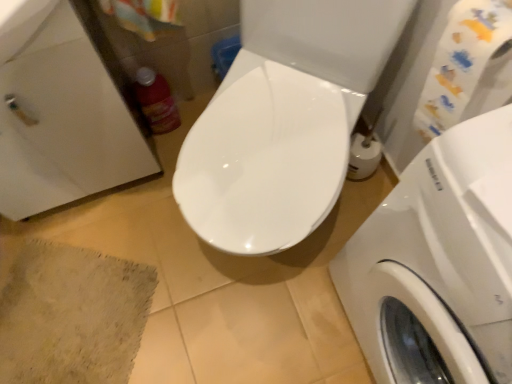
Question: From a real-world perspective, does matte plastic bottle at left sit lower than white glossy washing machine at right?

Choices:
 (A) yes
 (B) no

Answer: (A)

Question: Is white glossy washing machine at right inside matte plastic bottle at left?

Choices:
 (A) yes
 (B) no

Answer: (B)

Question: From a real-world perspective, is matte plastic bottle at left located higher than white glossy washing machine at right?

Choices:
 (A) yes
 (B) no

Answer: (B)

Question: From the image's perspective, is matte plastic bottle at left located beneath white glossy washing machine at right?

Choices:
 (A) yes
 (B) no

Answer: (B)

Question: Considering the relative sizes of matte plastic bottle at left and white glossy washing machine at right in the image provided, is matte plastic bottle at left taller than white glossy washing machine at right?

Choices:
 (A) no
 (B) yes

Answer: (A)

Question: Does matte plastic bottle at left turn towards white glossy washing machine at right?

Choices:
 (A) no
 (B) yes

Answer: (A)

Question: Does matte plastic bottle at left have a greater width compared to white glossy sink at upper left?

Choices:
 (A) yes
 (B) no

Answer: (B)

Question: Would you say matte plastic bottle at left contains white glossy sink at upper left?

Choices:
 (A) no
 (B) yes

Answer: (A)

Question: Is matte plastic bottle at left at the left side of white glossy sink at upper left?

Choices:
 (A) no
 (B) yes

Answer: (A)

Question: Does matte plastic bottle at left have a lesser height compared to white glossy sink at upper left?

Choices:
 (A) yes
 (B) no

Answer: (A)

Question: From the image's perspective, is matte plastic bottle at left located above white glossy sink at upper left?

Choices:
 (A) no
 (B) yes

Answer: (B)

Question: Can you confirm if matte plastic bottle at left is smaller than white glossy sink at upper left?

Choices:
 (A) no
 (B) yes

Answer: (B)

Question: From the image's perspective, does matte plastic bottle at left appear higher than beige textured bath mat at lower left?

Choices:
 (A) yes
 (B) no

Answer: (A)